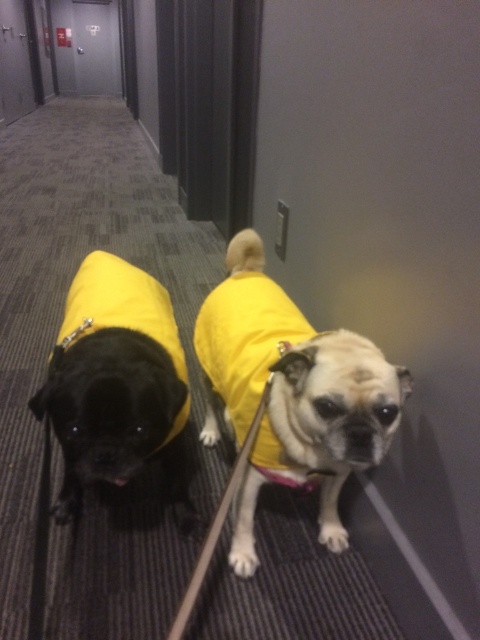
Can you confirm if yellow fabric dog at center is smaller than shiny black pug at left?

No, yellow fabric dog at center is not smaller than shiny black pug at left.

Who is taller, yellow fabric dog at center or shiny black pug at left?

yellow fabric dog at center

Between point (261, 240) and point (90, 476), which one is positioned in front?

Point (90, 476) is more forward.

Locate an element on the screen. yellow fabric dog at center is located at coordinates (291, 392).